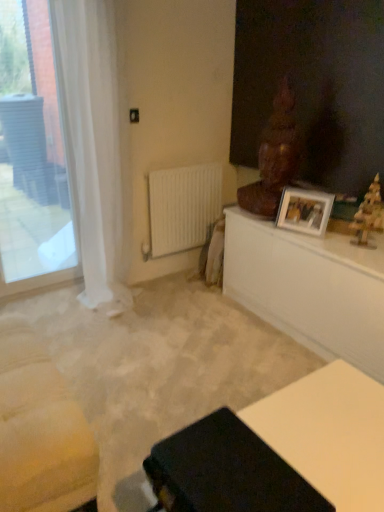
Identify the location of empty space that is to the right of transparent glass window at left. (69, 298).